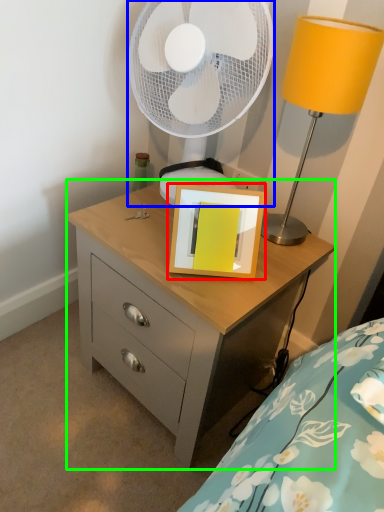
Question: Which object is positioned closest to picture frame (highlighted by a red box)? Select from mechanical fan (highlighted by a blue box) and chest of drawers (highlighted by a green box).

Choices:
 (A) mechanical fan
 (B) chest of drawers

Answer: (B)